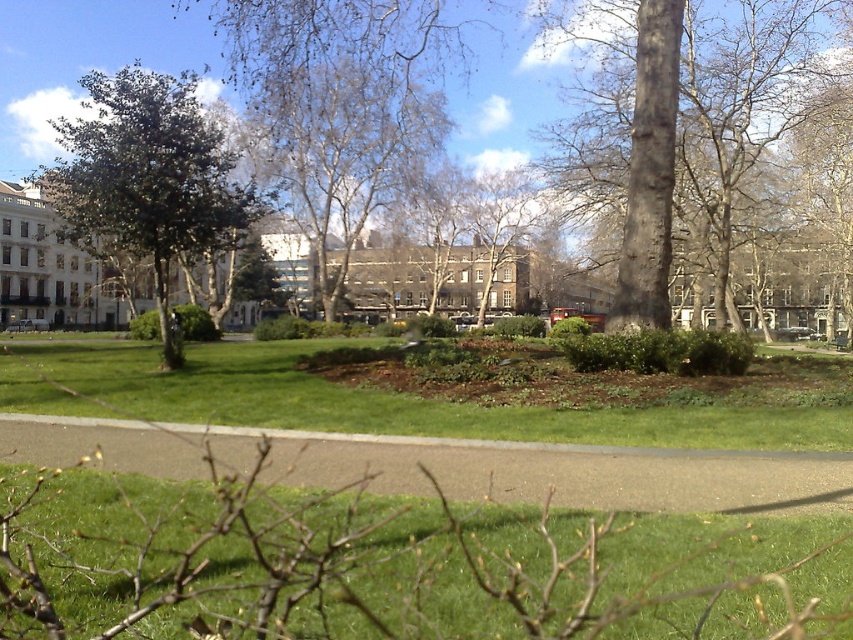
Question: Which point is farther to the camera?

Choices:
 (A) (546, 163)
 (B) (363, 83)
 (C) (306, 586)
 (D) (67, 122)

Answer: (A)

Question: Which point is farther to the camera?

Choices:
 (A) green leafy tree at left
 (B) green grassy area at center

Answer: (A)

Question: Estimate the real-world distances between objects in this image. Which object is closer to the smooth gray bark tree at center?

Choices:
 (A) green grass at lower center
 (B) bare white tree at center
 (C) green grassy area at center
 (D) green leafy tree at left

Answer: (B)

Question: In this image, where is green grassy area at center located relative to bare white tree at center?

Choices:
 (A) below
 (B) above

Answer: (A)

Question: Where is smooth gray bark tree at center located in relation to bare white tree at center in the image?

Choices:
 (A) above
 (B) below

Answer: (B)

Question: Is smooth gray bark tree at center to the right of bare white tree at center from the viewer's perspective?

Choices:
 (A) no
 (B) yes

Answer: (B)